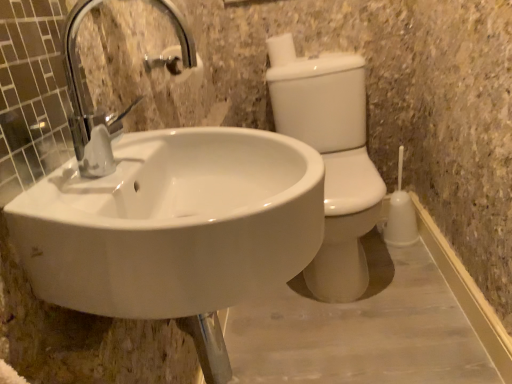
Question: Does white glossy toilet bowl at right lie in front of white matte toilet paper at upper center?

Choices:
 (A) yes
 (B) no

Answer: (A)

Question: From the image's perspective, is white glossy toilet bowl at right over white matte toilet paper at upper center?

Choices:
 (A) no
 (B) yes

Answer: (A)

Question: Does white glossy toilet bowl at right have a lesser width compared to white matte toilet paper at upper center?

Choices:
 (A) yes
 (B) no

Answer: (B)

Question: Does white glossy toilet bowl at right have a greater width compared to white matte toilet paper at upper center?

Choices:
 (A) yes
 (B) no

Answer: (A)

Question: From a real-world perspective, is white glossy toilet bowl at right beneath white matte toilet paper at upper center?

Choices:
 (A) no
 (B) yes

Answer: (B)

Question: In terms of height, does white glossy toilet bowl at right look taller or shorter compared to white matte toilet paper at upper center?

Choices:
 (A) tall
 (B) short

Answer: (A)

Question: Based on their sizes in the image, would you say white glossy toilet bowl at right is bigger or smaller than white matte toilet paper at upper center?

Choices:
 (A) small
 (B) big

Answer: (B)

Question: From a real-world perspective, relative to white matte toilet paper at upper center, is white glossy toilet bowl at right vertically above or below?

Choices:
 (A) below
 (B) above

Answer: (A)

Question: Relative to white matte toilet paper at upper center, is white glossy toilet bowl at right in front or behind?

Choices:
 (A) front
 (B) behind

Answer: (A)

Question: From the image's perspective, is white glossy sink at center above or below white matte toilet paper at upper center?

Choices:
 (A) below
 (B) above

Answer: (A)

Question: From their relative heights in the image, would you say white glossy sink at center is taller or shorter than white matte toilet paper at upper center?

Choices:
 (A) tall
 (B) short

Answer: (A)

Question: Considering the positions of point (188, 228) and point (275, 41), is point (188, 228) closer or farther from the camera than point (275, 41)?

Choices:
 (A) farther
 (B) closer

Answer: (B)

Question: Which is correct: white glossy sink at center is inside white matte toilet paper at upper center, or outside of it?

Choices:
 (A) inside
 (B) outside

Answer: (B)

Question: Based on their sizes in the image, would you say white matte toilet paper at upper center is bigger or smaller than white glossy sink at center?

Choices:
 (A) big
 (B) small

Answer: (B)

Question: From their relative heights in the image, would you say white matte toilet paper at upper center is taller or shorter than white glossy sink at center?

Choices:
 (A) tall
 (B) short

Answer: (B)